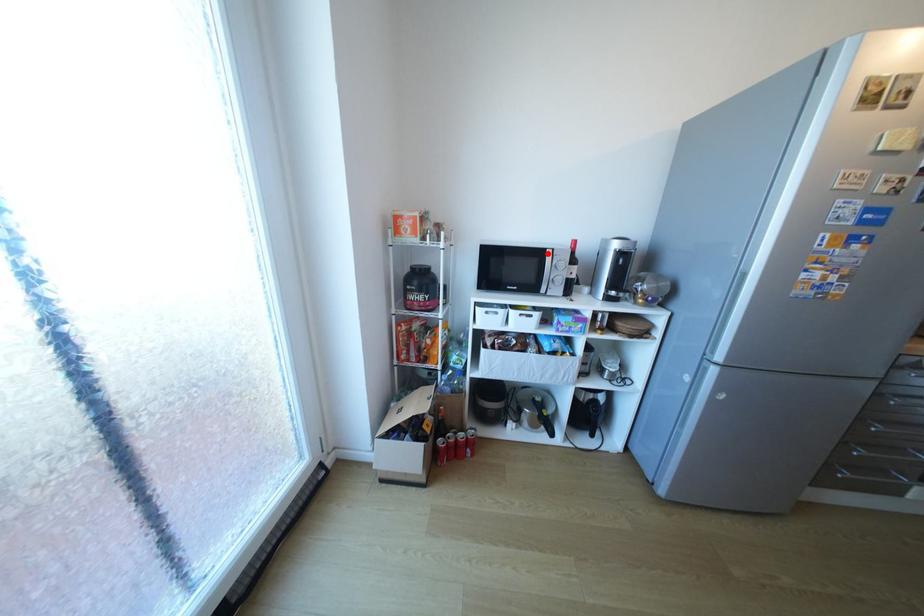
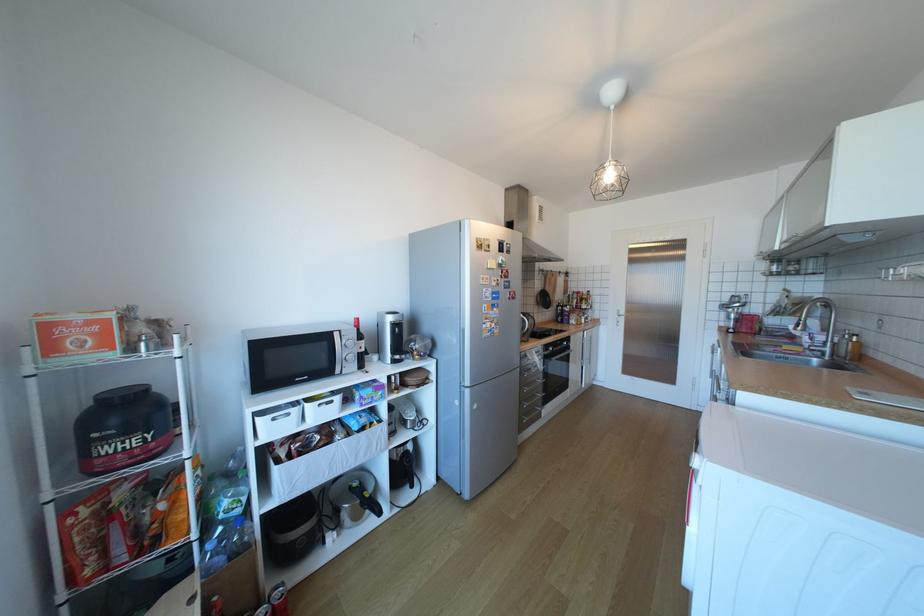
The point at the highlighted location is marked in the first image. Where is the corresponding point in the second image?

(334, 338)